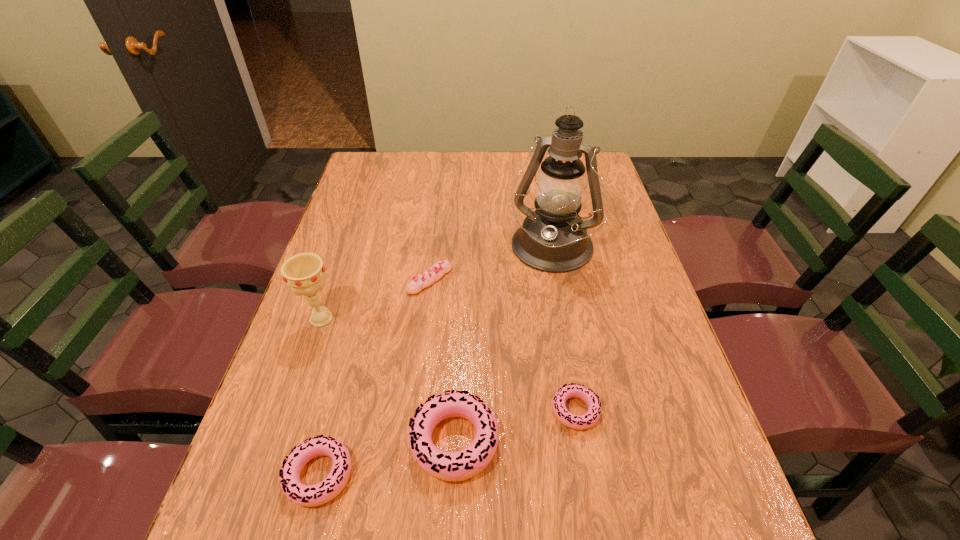
Where is `blank region between the oil lamp and the shortest doughnut`? The height and width of the screenshot is (540, 960). blank region between the oil lamp and the shortest doughnut is located at coordinates (563, 330).

The height and width of the screenshot is (540, 960). What are the coordinates of `unoccupied area between the oil lamp and the rightmost doughnut` in the screenshot? It's located at 563,330.

Image resolution: width=960 pixels, height=540 pixels. I want to click on free space between the chalice and the leftmost doughnut, so click(x=321, y=397).

This screenshot has height=540, width=960. I want to click on the fifth closest object relative to the second tallest doughnut, so click(x=553, y=238).

You are a GUI agent. You are given a task and a screenshot of the screen. Output one action in this format:
    pyautogui.click(x=<x>, y=<y>)
    Task: Click on the closest object relative to the second doughnut from right to left
    Image resolution: width=960 pixels, height=540 pixels.
    Given the screenshot: What is the action you would take?
    pyautogui.click(x=305, y=495)

Identify the location of doughnut that is the third nearest to the eclair. This screenshot has width=960, height=540. (305, 495).

Select which doughnut is the closest to the eclair. Please provide its 2D coordinates. Your answer should be formatted as a tuple, i.e. [(x, y)], where the tuple contains the x and y coordinates of a point satisfying the conditions above.

[(461, 465)]

The width and height of the screenshot is (960, 540). I want to click on free spot that satisfies the following two spatial constraints: 1. on the back side of the rightmost doughnut; 2. on the right side of the tallest object, so click(x=548, y=250).

You are a GUI agent. You are given a task and a screenshot of the screen. Output one action in this format:
    pyautogui.click(x=<x>, y=<y>)
    Task: Click on the free space that satisfies the following two spatial constraints: 1. on the back side of the second tallest doughnut; 2. on the right side of the shortest doughnut
    This screenshot has width=960, height=540.
    Given the screenshot: What is the action you would take?
    (336, 410)

In order to click on free region that satisfies the following two spatial constraints: 1. on the back side of the chalice; 2. on the right side of the eclair in this screenshot , I will do 334,280.